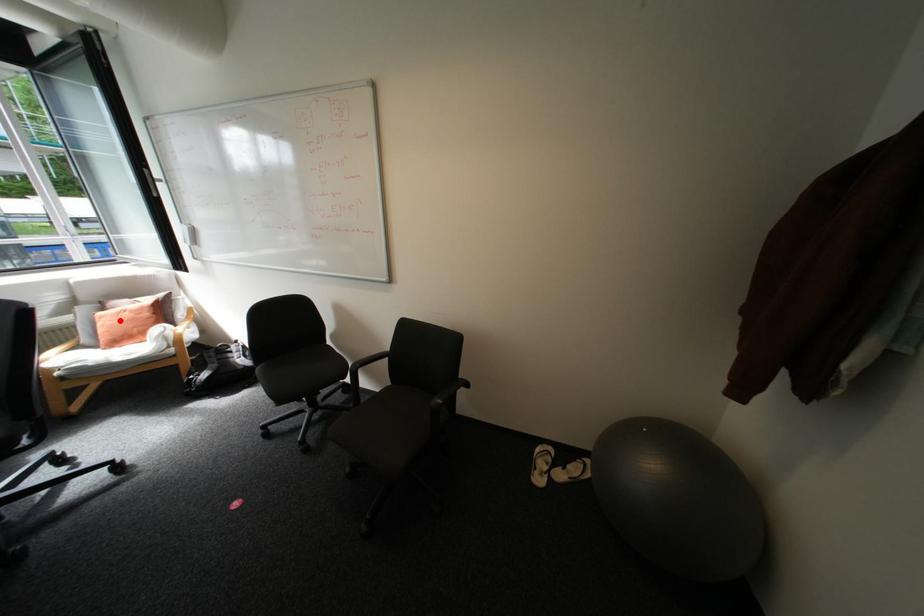
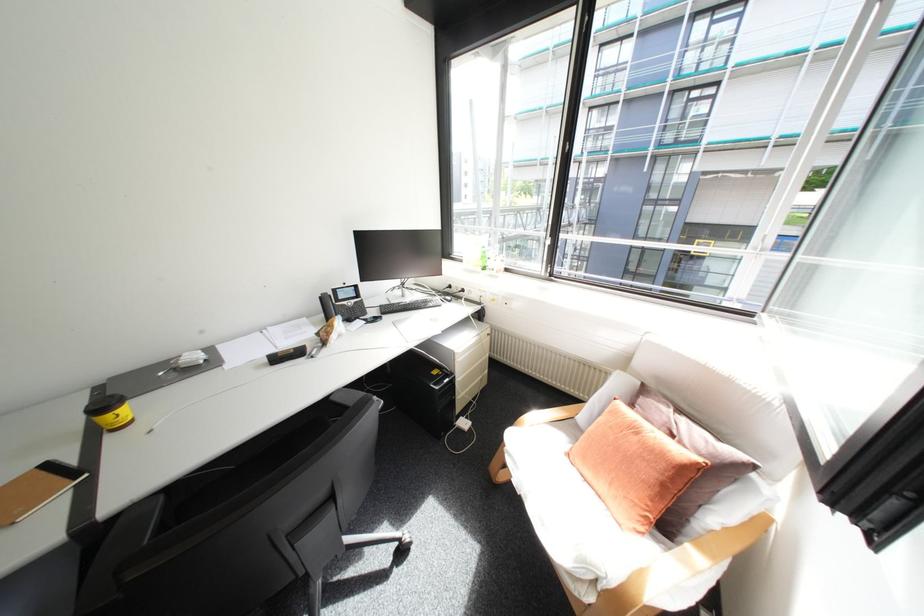
Where in the second image is the point corresponding to the highlighted location from the first image?

(621, 428)